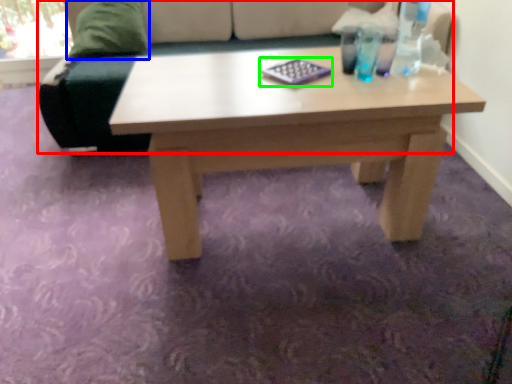
Question: Considering the real-world distances, which object is closest to studio couch (highlighted by a red box)? pillow (highlighted by a blue box) or pad (highlighted by a green box).

Choices:
 (A) pillow
 (B) pad

Answer: (A)